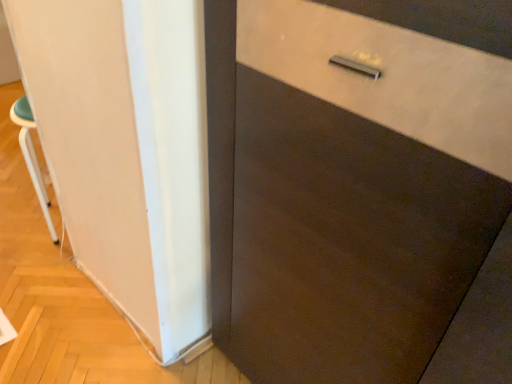
Find the location of a particular element. This screenshot has height=384, width=512. vacant area that is in front of white plastic stool at left is located at coordinates (37, 258).